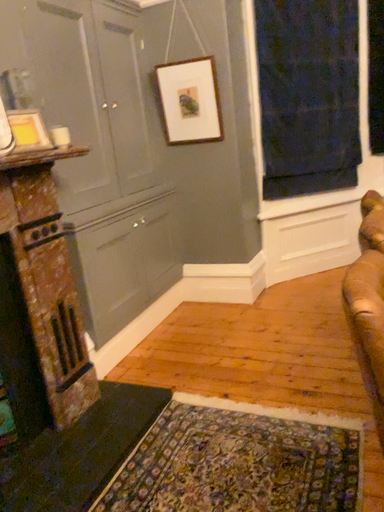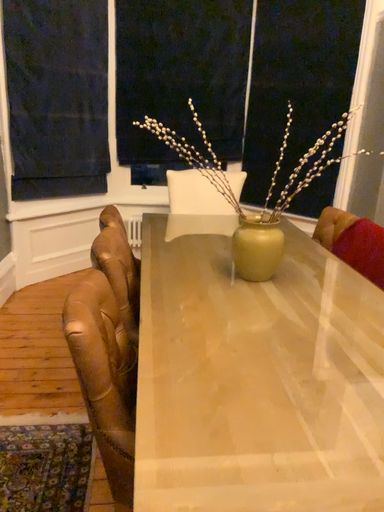
Question: Which way did the camera rotate in the video?

Choices:
 (A) rotated right
 (B) rotated left

Answer: (A)